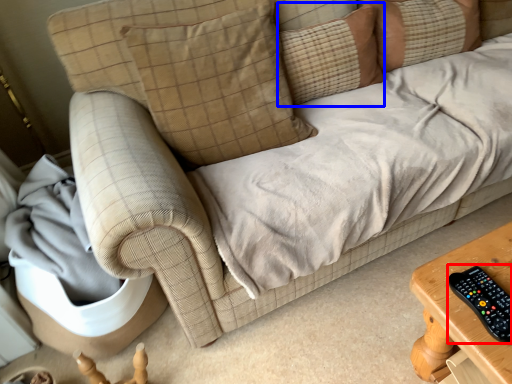
Question: Which point is further to the camera, control (highlighted by a red box) or pillow (highlighted by a blue box)?

Choices:
 (A) control
 (B) pillow

Answer: (B)